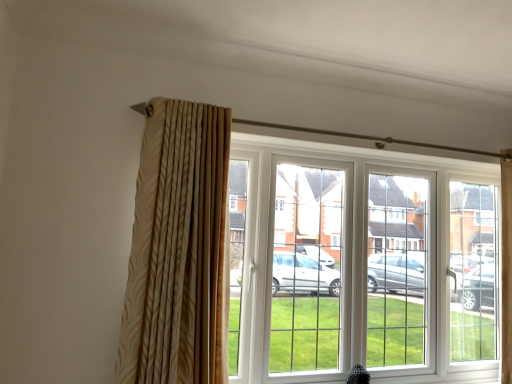
Question: In the image, is white plastic window at center positioned in front of or behind beige textured curtain at left?

Choices:
 (A) behind
 (B) front

Answer: (A)

Question: Is white plastic window at center inside or outside of beige textured curtain at left?

Choices:
 (A) inside
 (B) outside

Answer: (B)

Question: Does point (296, 142) appear closer or farther from the camera than point (179, 248)?

Choices:
 (A) closer
 (B) farther

Answer: (B)

Question: Looking at the image, does beige textured curtain at left seem bigger or smaller compared to white plastic window at center?

Choices:
 (A) small
 (B) big

Answer: (A)

Question: Considering the positions of beige textured curtain at left and white plastic window at center in the image, is beige textured curtain at left wider or thinner than white plastic window at center?

Choices:
 (A) thin
 (B) wide

Answer: (A)

Question: Choose the correct answer: Is beige textured curtain at left inside white plastic window at center or outside it?

Choices:
 (A) inside
 (B) outside

Answer: (B)

Question: In the image, is beige textured curtain at left on the left side or the right side of white plastic window at center?

Choices:
 (A) right
 (B) left

Answer: (B)